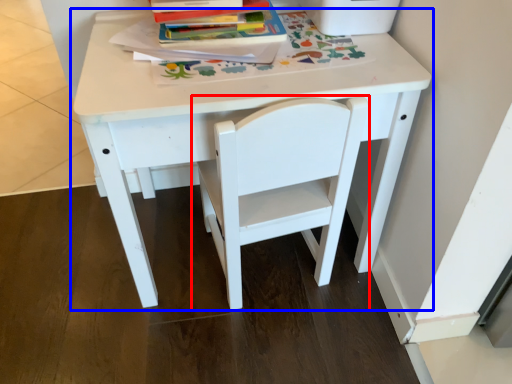
Question: Which object appears closest to the camera in this image, chair (highlighted by a red box) or table (highlighted by a blue box)?

Choices:
 (A) chair
 (B) table

Answer: (A)